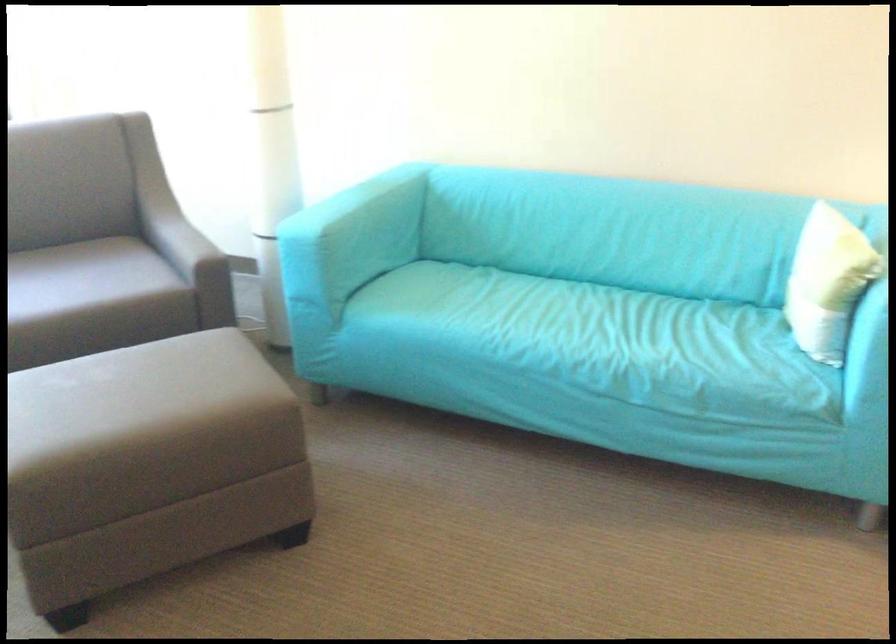
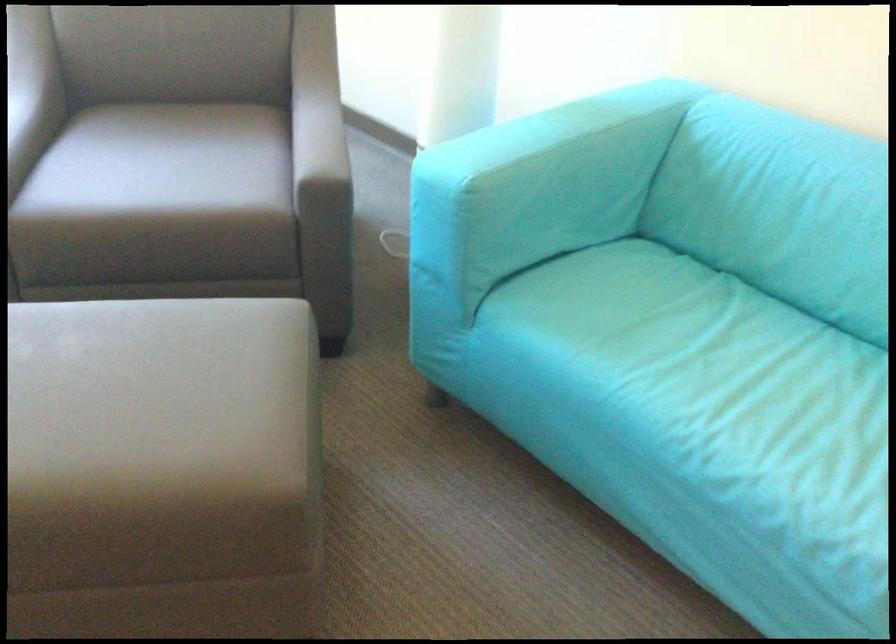
Question: The images are taken continuously from a first-person perspective. In which direction are you moving?

Choices:
 (A) Left
 (B) Right
 (C) Forward
 (D) Backward

Answer: (C)